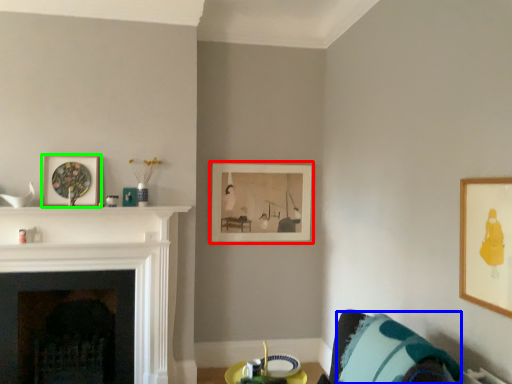
Question: Based on their relative distances, which object is nearer to picture frame (highlighted by a red box)? Choose from pillow (highlighted by a blue box) and picture frame (highlighted by a green box).

Choices:
 (A) pillow
 (B) picture frame

Answer: (B)